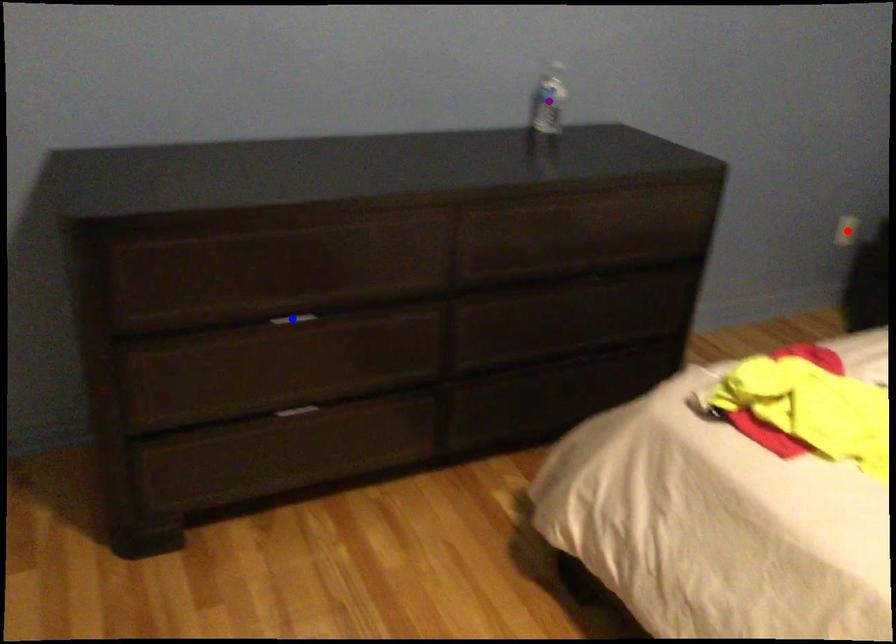
Order these from nearest to farthest:
- blue point
- purple point
- red point

blue point
purple point
red point